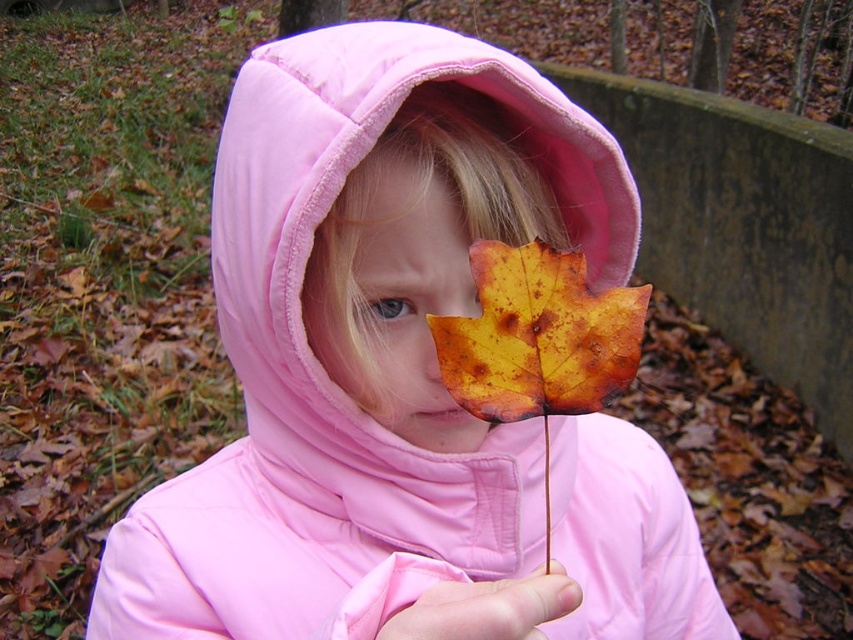
Can you confirm if matte pink jacket at center is positioned to the left of yellow matte leaf at center?

In fact, matte pink jacket at center is to the right of yellow matte leaf at center.

Does point (720, 628) come behind point (370, 273)?

Yes, it is behind point (370, 273).

The width and height of the screenshot is (853, 640). I want to click on matte pink jacket at center, so click(363, 337).

Image resolution: width=853 pixels, height=640 pixels. What do you see at coordinates (363, 337) in the screenshot?
I see `matte pink jacket at center` at bounding box center [363, 337].

Does point (315, 186) lie behind point (505, 90)?

No, it is in front of (505, 90).

The height and width of the screenshot is (640, 853). I want to click on matte pink jacket at center, so click(363, 337).

Between pink fleece hood at center and yellow matte leaf at center, which one appears on the left side from the viewer's perspective?

Positioned to the left is yellow matte leaf at center.

Which of these two, pink fleece hood at center or yellow matte leaf at center, stands shorter?

Standing shorter between the two is yellow matte leaf at center.

Does point (560, 128) come farther from viewer compared to point (415, 406)?

No, it is not.

Where is `pink fleece hood at center`? pink fleece hood at center is located at coordinates (361, 157).